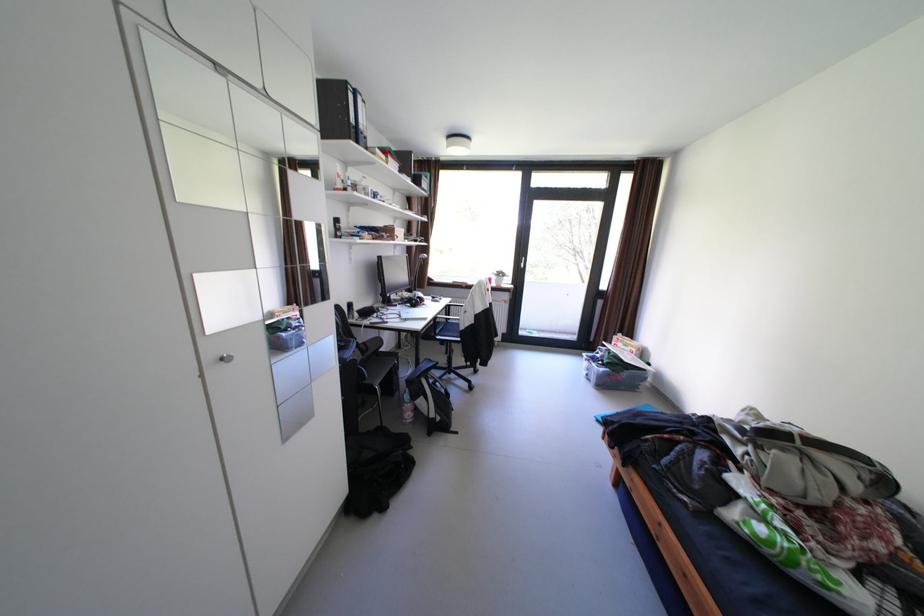
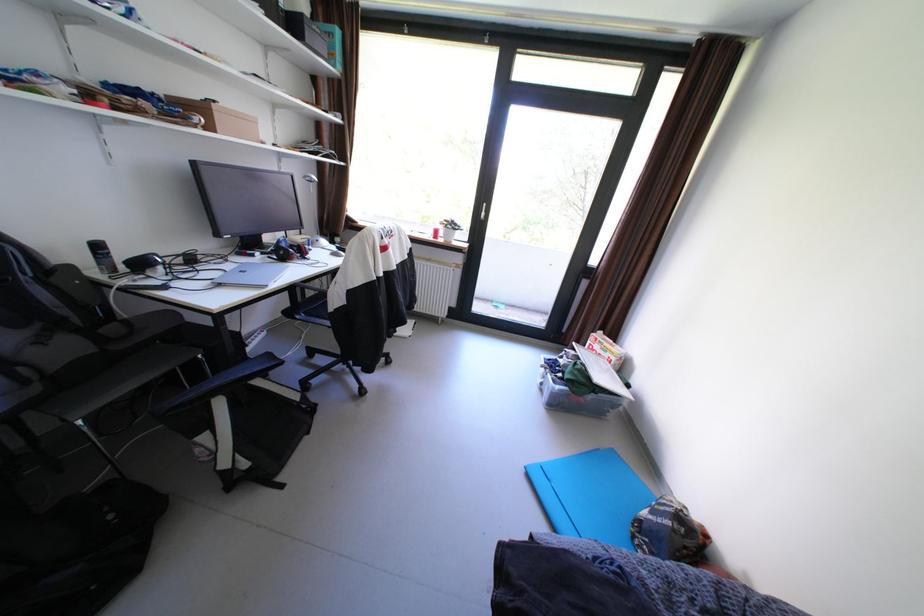
The images are taken continuously from a first-person perspective. In which direction are you moving?

The cameraman walked toward right, forward.